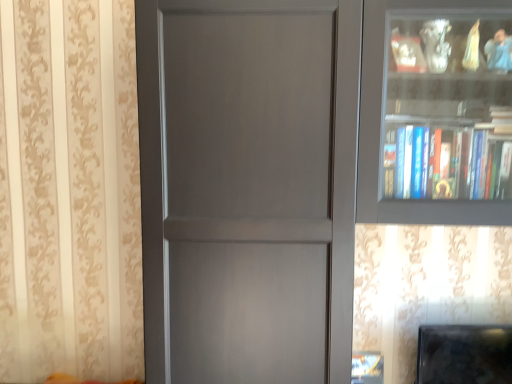
The width and height of the screenshot is (512, 384). What are the coordinates of `matte gray door at center` in the screenshot? It's located at (248, 188).

The width and height of the screenshot is (512, 384). Describe the element at coordinates (248, 188) in the screenshot. I see `matte gray door at center` at that location.

At what (x,y) coordinates should I click in order to perform the action: click on matte gray door at center. Please return your answer as a coordinate pair (x, y). The height and width of the screenshot is (384, 512). Looking at the image, I should click on (248, 188).